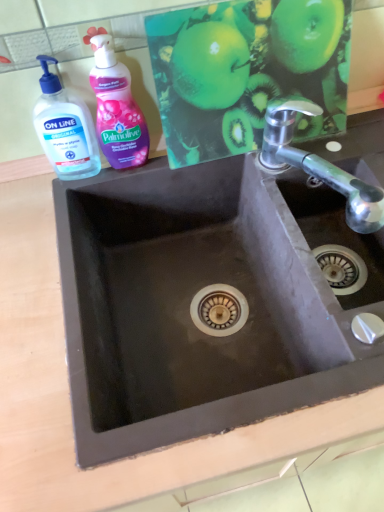
Question: From the image's perspective, is polished chrome tap at upper right positioned above or below pink glossy liquid soap at upper left?

Choices:
 (A) below
 (B) above

Answer: (A)

Question: Visually, is polished chrome tap at upper right positioned to the left or to the right of pink glossy liquid soap at upper left?

Choices:
 (A) left
 (B) right

Answer: (B)

Question: Based on their relative distances, which object is nearer to the pink glossy liquid soap at upper left?

Choices:
 (A) black matte sink at center
 (B) polished chrome tap at upper right
 (C) transparent plastic hand soap at upper left
 (D) green matte apple at upper center

Answer: (C)

Question: Which is farther from the green matte apple at upper center?

Choices:
 (A) transparent plastic hand soap at upper left
 (B) black matte sink at center
 (C) polished chrome tap at upper right
 (D) pink glossy liquid soap at upper left

Answer: (A)